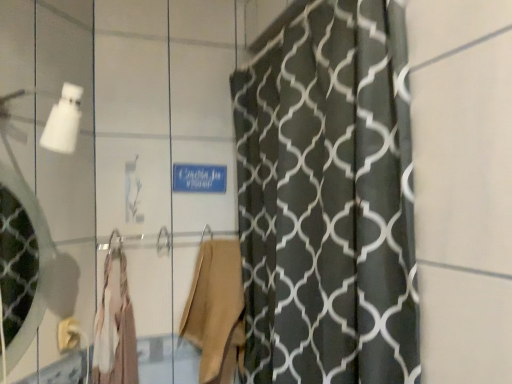
Image resolution: width=512 pixels, height=384 pixels. What do you see at coordinates (216, 311) in the screenshot?
I see `beige fabric robe at center, the 2th robe from the left` at bounding box center [216, 311].

This screenshot has height=384, width=512. What do you see at coordinates (21, 267) in the screenshot? I see `clear glass mirror at left` at bounding box center [21, 267].

The image size is (512, 384). What are the coordinates of `beige fabric robe at center, the 2th robe from the left` in the screenshot? It's located at (216, 311).

Is light beige fabric robe at center, which is counted as the first robe, starting from the left, inside beige fabric robe at center, the 2th robe from the left?

No, light beige fabric robe at center, which is counted as the first robe, starting from the left, is not inside beige fabric robe at center, the 2th robe from the left.

Does beige fabric robe at center, which ranks as the 1th robe in right-to-left order, appear on the right side of light beige fabric robe at center, acting as the second robe starting from the right?

Yes, beige fabric robe at center, which ranks as the 1th robe in right-to-left order, is to the right of light beige fabric robe at center, acting as the second robe starting from the right.

Considering the positions of point (220, 378) and point (129, 343), is point (220, 378) closer or farther from the camera than point (129, 343)?

Clearly, point (220, 378) is more distant from the camera than point (129, 343).

Considering the sizes of objects beige fabric robe at center, which ranks as the 1th robe in right-to-left order, and light beige fabric robe at center, acting as the second robe starting from the right, in the image provided, who is smaller, beige fabric robe at center, which ranks as the 1th robe in right-to-left order, or light beige fabric robe at center, acting as the second robe starting from the right,?

With smaller size is light beige fabric robe at center, acting as the second robe starting from the right.

From a real-world perspective, is clear glass mirror at left located higher than matte gold towel bar at lower left?

Yes, from a real-world perspective, clear glass mirror at left is over matte gold towel bar at lower left

Can you confirm if clear glass mirror at left is bigger than matte gold towel bar at lower left?

Yes.

Locate an element on the screen. Image resolution: width=512 pixels, height=384 pixels. mirror located above the matte gold towel bar at lower left (from the image's perspective) is located at coordinates pyautogui.click(x=21, y=267).

Would you say clear glass mirror at left is inside or outside matte gold towel bar at lower left?

clear glass mirror at left is spatially situated outside matte gold towel bar at lower left.

From the image's perspective, which one is positioned lower, beige fabric robe at center, which ranks as the 1th robe in right-to-left order, or clear glass mirror at left?

beige fabric robe at center, which ranks as the 1th robe in right-to-left order.

Looking at their sizes, would you say beige fabric robe at center, the 2th robe from the left, is wider or thinner than clear glass mirror at left?

Considering their sizes, beige fabric robe at center, the 2th robe from the left, looks broader than clear glass mirror at left.

In the scene shown: Can you tell me how much beige fabric robe at center, the 2th robe from the left, and clear glass mirror at left differ in facing direction?

The angular difference between beige fabric robe at center, the 2th robe from the left, and clear glass mirror at left is 53 degrees.

How far apart are beige fabric robe at center, which ranks as the 1th robe in right-to-left order, and clear glass mirror at left?

30.63 inches.

Consider the image. What's the angular difference between light beige fabric robe at center, which is counted as the first robe, starting from the left, and clear glass mirror at left's facing directions?

53 degrees separate the facing orientations of light beige fabric robe at center, which is counted as the first robe, starting from the left, and clear glass mirror at left.

Is clear glass mirror at left at the back of light beige fabric robe at center, acting as the second robe starting from the right?

That's not correct — light beige fabric robe at center, acting as the second robe starting from the right, is not looking away from clear glass mirror at left.

Considering the points (116, 332) and (39, 228), which point is behind, point (116, 332) or point (39, 228)?

The point (116, 332) is farther.

This screenshot has width=512, height=384. I want to click on mirror above the light beige fabric robe at center, which is counted as the first robe, starting from the left (from the image's perspective), so click(21, 267).

Which is less distant, (199, 282) or (60, 340)?

Point (199, 282) is positioned farther from the camera compared to point (60, 340).

From the image's perspective, is beige fabric robe at center, which ranks as the 1th robe in right-to-left order, on matte gold towel bar at lower left?

No, from the image's perspective, beige fabric robe at center, which ranks as the 1th robe in right-to-left order, is not over matte gold towel bar at lower left.

Is beige fabric robe at center, which ranks as the 1th robe in right-to-left order, bigger than matte gold towel bar at lower left?

Yes, beige fabric robe at center, which ranks as the 1th robe in right-to-left order, is bigger than matte gold towel bar at lower left.

Considering the positions of points (69, 322) and (240, 264), is point (69, 322) farther from camera compared to point (240, 264)?

That is False.

Does matte gold towel bar at lower left have a smaller size compared to beige fabric robe at center, the 2th robe from the left?

Yes.

From a real-world perspective, between matte gold towel bar at lower left and beige fabric robe at center, which ranks as the 1th robe in right-to-left order, who is vertically higher?

matte gold towel bar at lower left, from a real-world perspective.

Is matte gold towel bar at lower left at the right side of beige fabric robe at center, which ranks as the 1th robe in right-to-left order?

Incorrect, matte gold towel bar at lower left is not on the right side of beige fabric robe at center, which ranks as the 1th robe in right-to-left order.

From a real-world perspective, is light beige fabric robe at center, which is counted as the first robe, starting from the left, below beige fabric robe at center, which ranks as the 1th robe in right-to-left order?

No, from a real-world perspective, light beige fabric robe at center, which is counted as the first robe, starting from the left, is not beneath beige fabric robe at center, which ranks as the 1th robe in right-to-left order.

From the image's perspective, is light beige fabric robe at center, acting as the second robe starting from the right, on beige fabric robe at center, the 2th robe from the left?

Yes, from the image's perspective, light beige fabric robe at center, acting as the second robe starting from the right, is on top of beige fabric robe at center, the 2th robe from the left.

From the picture: Is light beige fabric robe at center, acting as the second robe starting from the right, in front of or behind beige fabric robe at center, the 2th robe from the left, in the image?

light beige fabric robe at center, acting as the second robe starting from the right, is positioned closer to the viewer than beige fabric robe at center, the 2th robe from the left.

Does point (97, 355) lie in front of point (218, 253)?

That is True.

The width and height of the screenshot is (512, 384). I want to click on robe behind the light beige fabric robe at center, which is counted as the first robe, starting from the left, so click(x=216, y=311).

This screenshot has height=384, width=512. I want to click on mirror above the matte gold towel bar at lower left (from the image's perspective), so click(21, 267).

Looking at the image, which one is located further to clear glass mirror at left, light beige fabric robe at center, acting as the second robe starting from the right, or matte gold towel bar at lower left?

Based on the image, matte gold towel bar at lower left appears to be further to clear glass mirror at left.

Based on their spatial positions, is matte gold towel bar at lower left or light beige fabric robe at center, which is counted as the first robe, starting from the left, further from beige fabric robe at center, the 2th robe from the left?

Among the two, matte gold towel bar at lower left is located further to beige fabric robe at center, the 2th robe from the left.

From the image, which object appears to be nearer to clear glass mirror at left, matte gold towel bar at lower left or light beige fabric robe at center, acting as the second robe starting from the right?

The object closer to clear glass mirror at left is light beige fabric robe at center, acting as the second robe starting from the right.

From the picture: Estimate the real-world distances between objects in this image. Which object is further from beige fabric robe at center, the 2th robe from the left, light beige fabric robe at center, acting as the second robe starting from the right, or matte gold towel bar at lower left?

matte gold towel bar at lower left lies further to beige fabric robe at center, the 2th robe from the left, than the other object.

From the image, which object appears to be nearer to light beige fabric robe at center, which is counted as the first robe, starting from the left, matte gold towel bar at lower left or clear glass mirror at left?

matte gold towel bar at lower left.

When comparing their distances from clear glass mirror at left, does matte gold towel bar at lower left or beige fabric robe at center, which ranks as the 1th robe in right-to-left order, seem closer?

Based on the image, matte gold towel bar at lower left appears to be nearer to clear glass mirror at left.

Looking at the image, which one is located closer to clear glass mirror at left, beige fabric robe at center, which ranks as the 1th robe in right-to-left order, or matte gold towel bar at lower left?

matte gold towel bar at lower left is positioned closer to the anchor clear glass mirror at left.

Looking at the image, which one is located further to light beige fabric robe at center, acting as the second robe starting from the right, clear glass mirror at left or matte gold towel bar at lower left?

The object further to light beige fabric robe at center, acting as the second robe starting from the right, is clear glass mirror at left.

Find the location of `robe between matte gold towel bar at lower left and beige fabric robe at center, which ranks as the 1th robe in right-to-left order, in the horizontal direction`. robe between matte gold towel bar at lower left and beige fabric robe at center, which ranks as the 1th robe in right-to-left order, in the horizontal direction is located at coordinates (115, 327).

The height and width of the screenshot is (384, 512). What are the coordinates of `towel bar situated between clear glass mirror at left and beige fabric robe at center, which ranks as the 1th robe in right-to-left order, from left to right` in the screenshot? It's located at (71, 335).

The width and height of the screenshot is (512, 384). Find the location of `robe between clear glass mirror at left and beige fabric robe at center, the 2th robe from the left`. robe between clear glass mirror at left and beige fabric robe at center, the 2th robe from the left is located at coordinates (115, 327).

At what (x,y) coordinates should I click in order to perform the action: click on towel bar between clear glass mirror at left and light beige fabric robe at center, which is counted as the first robe, starting from the left, from front to back. Please return your answer as a coordinate pair (x, y). Image resolution: width=512 pixels, height=384 pixels. Looking at the image, I should click on (71, 335).